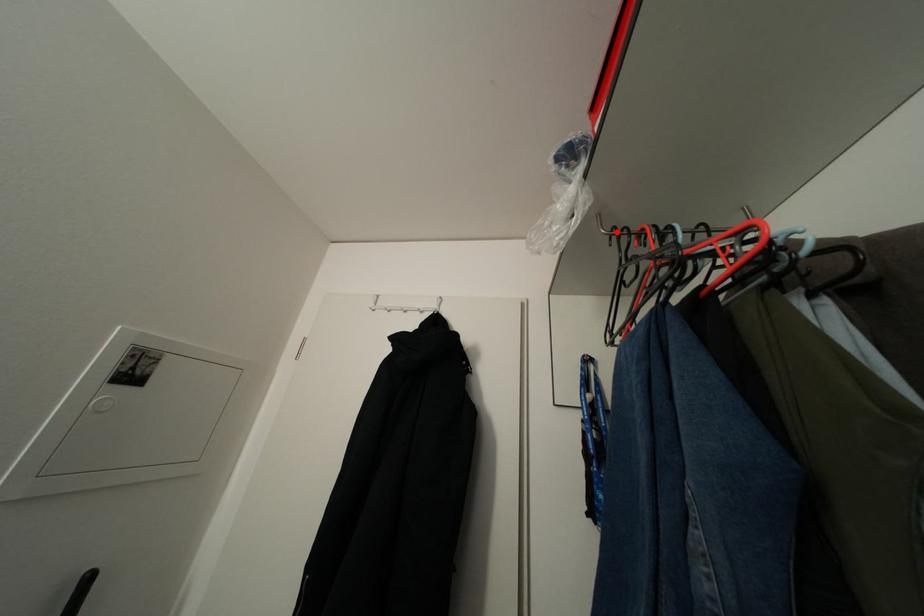
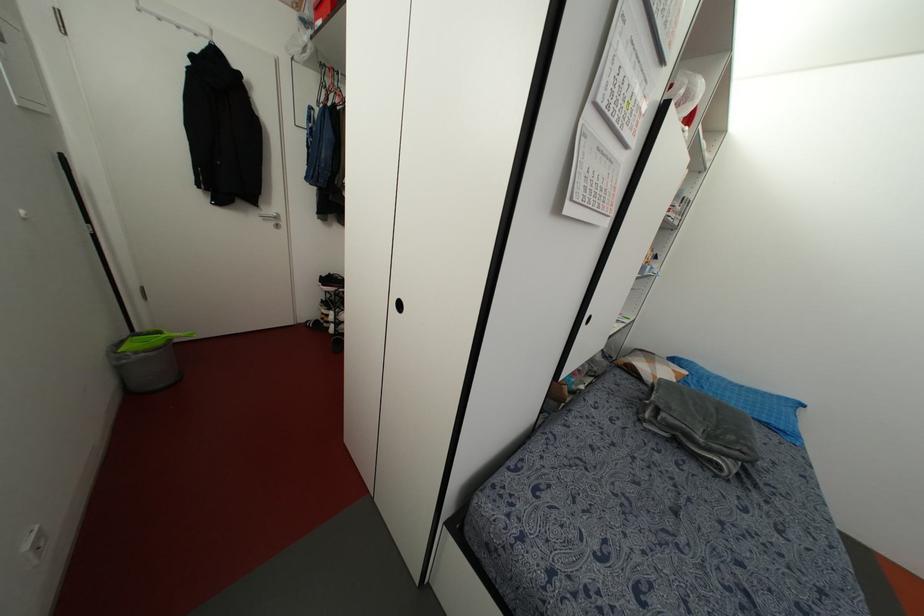
Question: I am providing you with two images of the same scene from different viewpoints. A red point is marked on the first image. Can you still see the location of the red point in image 2?

Choices:
 (A) Yes
 (B) No

Answer: (A)